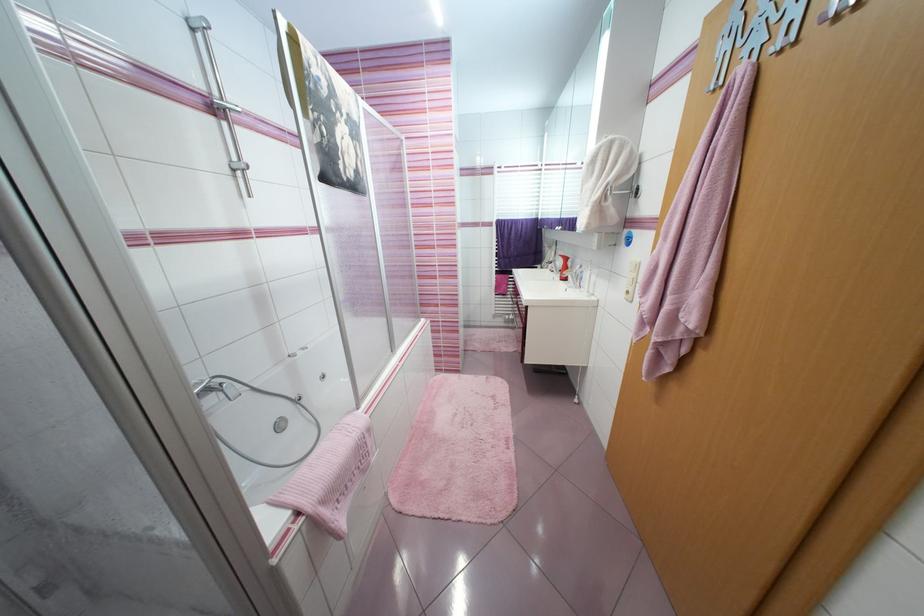
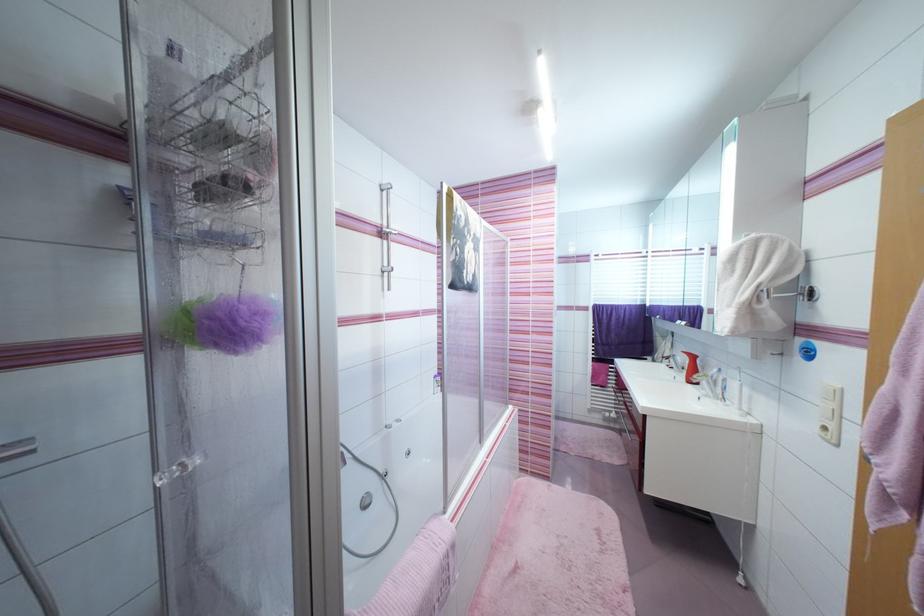
Find the pixel in the second image that matches (x=642, y=336) in the first image.

(883, 517)